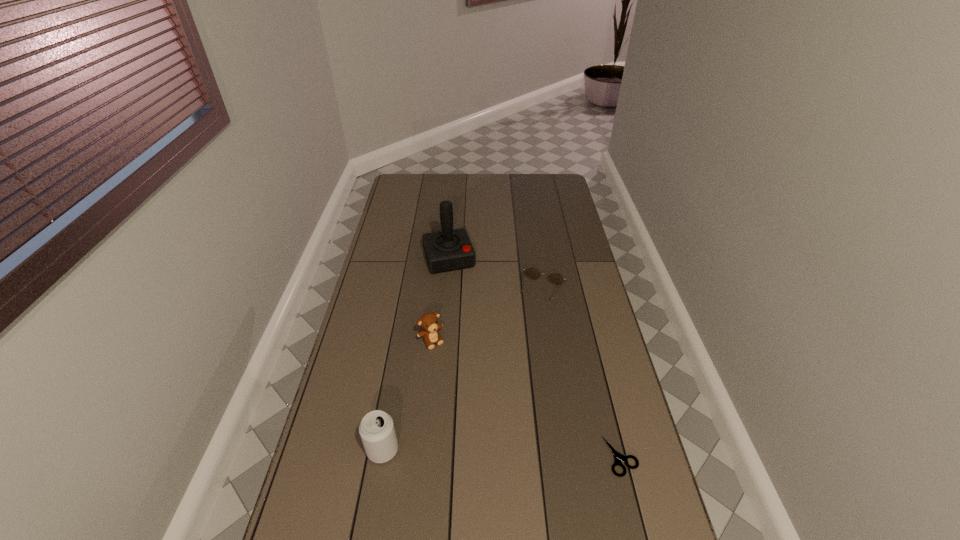
Locate an element on the screen. Image resolution: width=960 pixels, height=540 pixels. object that is positioned at the left edge is located at coordinates 377,432.

Image resolution: width=960 pixels, height=540 pixels. What are the coordinates of `shears that is positioned at the right edge` in the screenshot? It's located at (618, 457).

Find the location of a particular element. spectacles present at the right edge is located at coordinates (555, 278).

Locate an element on the screen. The width and height of the screenshot is (960, 540). free space at the far edge is located at coordinates (475, 184).

I want to click on free location at the near edge, so click(x=560, y=524).

Where is `vacant space at the left edge`? Image resolution: width=960 pixels, height=540 pixels. vacant space at the left edge is located at coordinates (401, 246).

The width and height of the screenshot is (960, 540). In the image, there is a desktop. What are the coordinates of `vacant area at the right edge` in the screenshot? It's located at 595,349.

Locate an element on the screen. This screenshot has height=540, width=960. vacant space at the far right corner is located at coordinates (561, 176).

Identify the location of free point between the farthest object and the second shortest object. (496, 275).

Where is `free spot between the fourth object from left to right and the can`? free spot between the fourth object from left to right and the can is located at coordinates (463, 370).